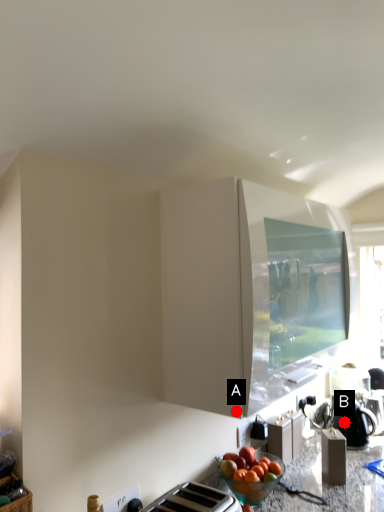
Question: Two points are circled on the image, labeled by A and B beside each circle. Which of the following is the closest to the observer?

Choices:
 (A) A is closer
 (B) B is closer

Answer: (A)